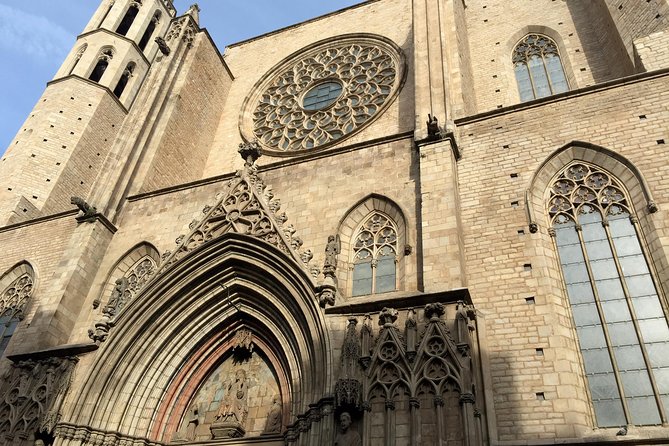
At what (x,y) coordinates should I click in order to perform the action: click on animal sculpture bottom left. Please return your answer as a coordinate pair (x, y). Looking at the image, I should click on (80, 202).